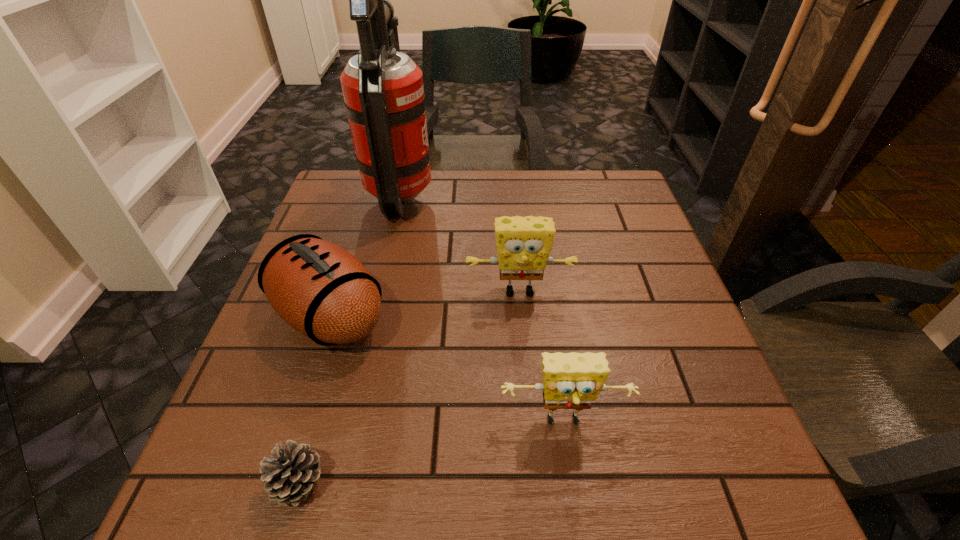
The height and width of the screenshot is (540, 960). I want to click on vacant space at the near edge of the desktop, so click(539, 468).

Identify the location of free location at the left edge of the desktop. (313, 374).

Find the location of a particular element. vacant area at the right edge of the desktop is located at coordinates (679, 326).

Locate an element on the screen. The width and height of the screenshot is (960, 540). free space at the far left corner is located at coordinates (356, 171).

In the image, there is a desktop. Where is `vacant space at the near left corner`? vacant space at the near left corner is located at coordinates (197, 515).

At what (x,y) coordinates should I click in order to perform the action: click on vacant space at the far right corner. Please return your answer as a coordinate pair (x, y). The width and height of the screenshot is (960, 540). Looking at the image, I should click on (579, 176).

Identify the location of vacant area at the near right corner of the desktop. This screenshot has width=960, height=540. (769, 486).

Where is `unoccupied area between the football (American) and the farther sponge`? unoccupied area between the football (American) and the farther sponge is located at coordinates (424, 303).

Find the location of a particular element. The width and height of the screenshot is (960, 540). vacant area that lies between the football (American) and the farther sponge is located at coordinates (424, 303).

Locate an element on the screen. This screenshot has width=960, height=540. unoccupied position between the football (American) and the fourth farthest object is located at coordinates (447, 369).